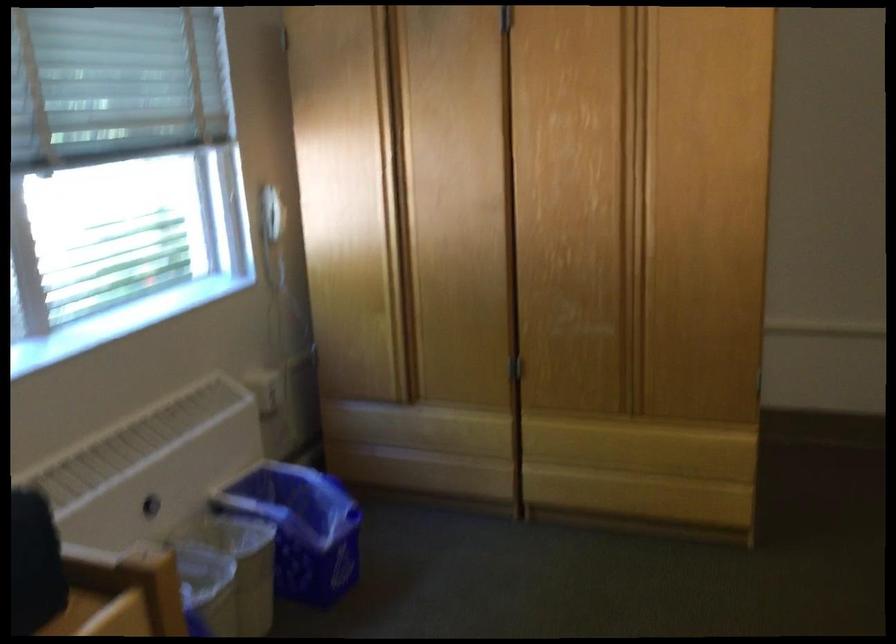
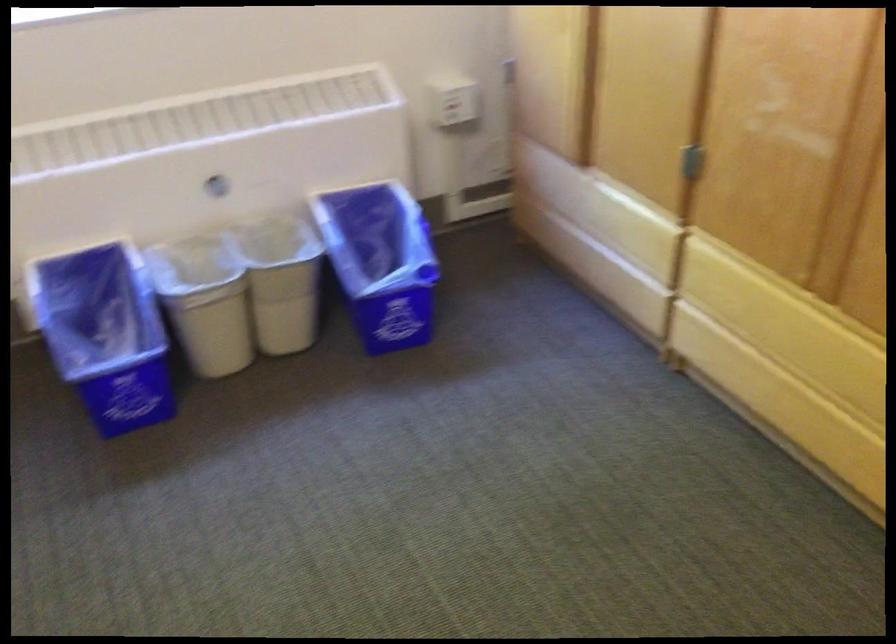
Find the pixel in the second image that matches point 519,366 in the first image.

(691, 162)